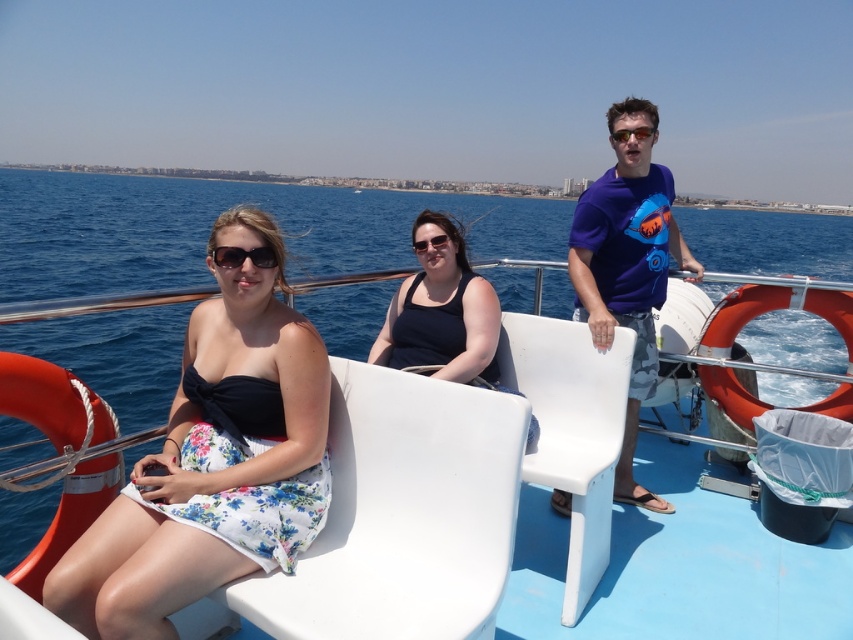
You are a photographer on the boat and want to capture both the matte black dress at center and the clear plastic goggles at center in a single frame. Since the camera has a limited focus range, which object should you prioritize focusing on to ensure it appears sharp?

The matte black dress at center is bigger than the clear plastic goggles at center, so you should prioritize focusing on the matte black dress at center because larger objects often require more precise focus to maintain sharpness.

You are on a boat and need to reach the clear plastic goggles at center to put them on. The matte black dress at center belongs to your friend who is sitting. Can you safely step over to the goggles without disturbing your friend?

The matte black dress at center is 6.99 feet away from clear plastic goggles at center. Since the distance is more than 6 feet, you can safely step over to the goggles without disturbing your friend.

You are on the boat and want to move from the point at coordinates point (442,598) to the point at coordinates point (268,445). Which direction should you move?

You should move backward because point (442,598) is in front of point (268,445).